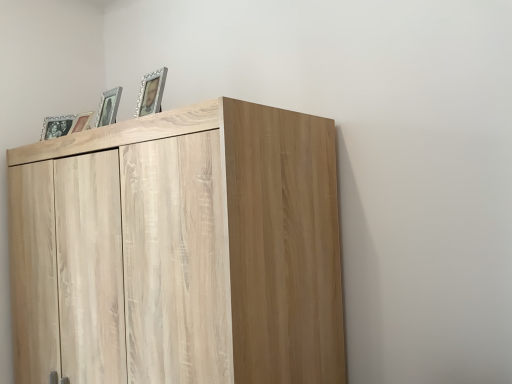
Question: Is the position of matte wooden picture frame at upper left, which is the 2th picture frame from left to right, more distant than that of light wood cupboard at upper left?

Choices:
 (A) no
 (B) yes

Answer: (B)

Question: From the image's perspective, is matte wooden picture frame at upper left, the 3th picture frame when ordered from right to left, beneath light wood cupboard at upper left?

Choices:
 (A) no
 (B) yes

Answer: (A)

Question: Is matte wooden picture frame at upper left, the 3th picture frame positioned from the front, bigger than light wood cupboard at upper left?

Choices:
 (A) no
 (B) yes

Answer: (A)

Question: Is matte wooden picture frame at upper left, the 3th picture frame positioned from the front, outside light wood cupboard at upper left?

Choices:
 (A) no
 (B) yes

Answer: (B)

Question: From the image's perspective, is matte wooden picture frame at upper left, which appears as the second picture frame when viewed from the back, over light wood cupboard at upper left?

Choices:
 (A) no
 (B) yes

Answer: (B)

Question: Considering the positions of point (113, 104) and point (88, 127), is point (113, 104) closer or farther from the camera than point (88, 127)?

Choices:
 (A) farther
 (B) closer

Answer: (B)

Question: Is matte silver picture frame at upper left, which ranks as the 2th picture frame in front-to-back order, wider or thinner than matte wooden picture frame at upper left, which is the 2th picture frame from left to right?

Choices:
 (A) wide
 (B) thin

Answer: (A)

Question: From the image's perspective, is matte silver picture frame at upper left, which appears as the third picture frame when viewed from the back, above or below matte wooden picture frame at upper left, the 3th picture frame positioned from the front?

Choices:
 (A) below
 (B) above

Answer: (B)

Question: Looking at the image, does matte silver picture frame at upper left, which appears as the third picture frame when viewed from the back, seem bigger or smaller compared to matte wooden picture frame at upper left, which appears as the second picture frame when viewed from the back?

Choices:
 (A) small
 (B) big

Answer: (B)

Question: From the image's perspective, is silver metallic photo frame at upper center, the 1th picture frame from the right, positioned above or below matte black picture frame at upper left, which is the first picture frame from left to right?

Choices:
 (A) below
 (B) above

Answer: (B)

Question: Is silver metallic photo frame at upper center, the 1th picture frame from the right, to the left or to the right of matte black picture frame at upper left, which appears as the first picture frame when viewed from the back, in the image?

Choices:
 (A) left
 (B) right

Answer: (B)

Question: Looking at their shapes, would you say silver metallic photo frame at upper center, the fourth picture frame viewed from the back, is wider or thinner than matte black picture frame at upper left, positioned as the fourth picture frame in front-to-back order?

Choices:
 (A) wide
 (B) thin

Answer: (B)

Question: Is silver metallic photo frame at upper center, which is the 1th picture frame in front-to-back order, bigger or smaller than matte black picture frame at upper left, positioned as the fourth picture frame in front-to-back order?

Choices:
 (A) big
 (B) small

Answer: (B)

Question: Looking at the image, does matte wooden picture frame at upper left, which is the 2th picture frame from left to right, seem bigger or smaller compared to light wood cupboard at upper left?

Choices:
 (A) big
 (B) small

Answer: (B)

Question: From a real-world perspective, is matte wooden picture frame at upper left, which is the 2th picture frame from left to right, positioned above or below light wood cupboard at upper left?

Choices:
 (A) above
 (B) below

Answer: (A)